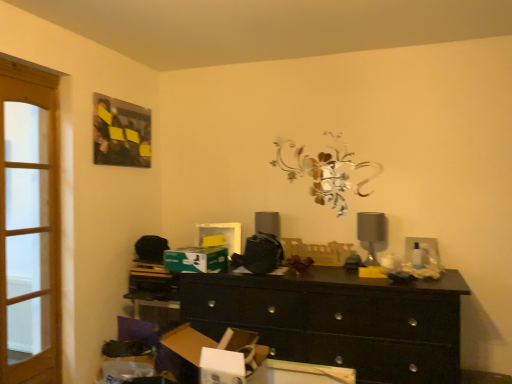
Question: Can you confirm if light brown wooden screen door at left is wider than black wood chest of drawers at center?

Choices:
 (A) yes
 (B) no

Answer: (B)

Question: Can you confirm if light brown wooden screen door at left is positioned to the right of black wood chest of drawers at center?

Choices:
 (A) no
 (B) yes

Answer: (A)

Question: From a real-world perspective, is light brown wooden screen door at left on top of black wood chest of drawers at center?

Choices:
 (A) no
 (B) yes

Answer: (B)

Question: Can you confirm if light brown wooden screen door at left is bigger than black wood chest of drawers at center?

Choices:
 (A) yes
 (B) no

Answer: (B)

Question: Is light brown wooden screen door at left positioned behind black wood chest of drawers at center?

Choices:
 (A) no
 (B) yes

Answer: (B)

Question: From the image's perspective, does light brown wooden screen door at left appear lower than black wood chest of drawers at center?

Choices:
 (A) no
 (B) yes

Answer: (A)

Question: Is black wood chest of drawers at center to the right of yellow plastic tray at center from the viewer's perspective?

Choices:
 (A) yes
 (B) no

Answer: (B)

Question: Is black wood chest of drawers at center placed right next to yellow plastic tray at center?

Choices:
 (A) yes
 (B) no

Answer: (B)

Question: Is the position of black wood chest of drawers at center more distant than that of yellow plastic tray at center?

Choices:
 (A) yes
 (B) no

Answer: (B)

Question: Would you say black wood chest of drawers at center contains yellow plastic tray at center?

Choices:
 (A) no
 (B) yes

Answer: (A)

Question: Does black wood chest of drawers at center have a lesser height compared to yellow plastic tray at center?

Choices:
 (A) no
 (B) yes

Answer: (A)

Question: Is black wood chest of drawers at center closer to the viewer compared to yellow plastic tray at center?

Choices:
 (A) yes
 (B) no

Answer: (A)

Question: Can you confirm if green cardboard box at center, the 1th cardboard box positioned from the top, is smaller than light brown wooden screen door at left?

Choices:
 (A) yes
 (B) no

Answer: (A)